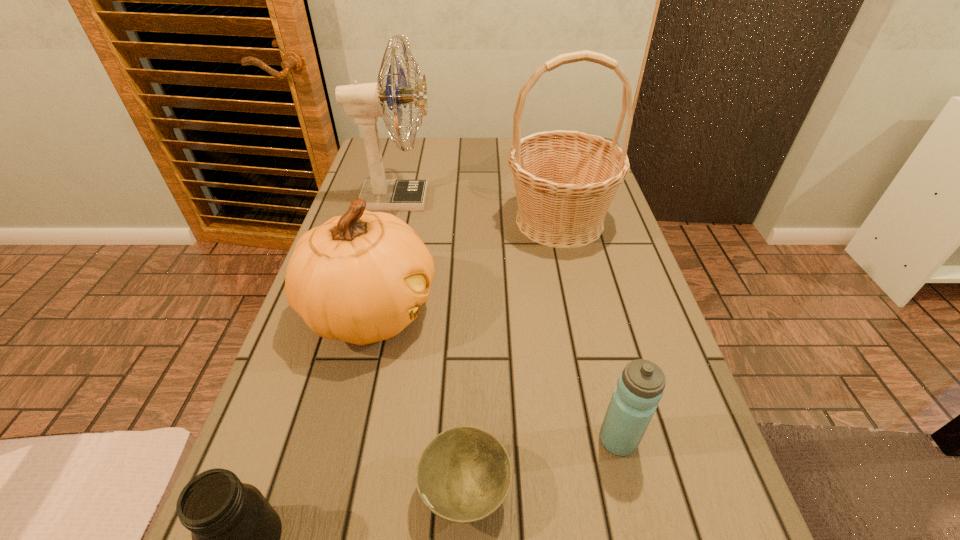
You are a GUI agent. You are given a task and a screenshot of the screen. Output one action in this format:
    pyautogui.click(x=<x>, y=<y>)
    Task: Click on the pumpkin positioned at the left edge
    
    Given the screenshot: What is the action you would take?
    pyautogui.click(x=360, y=278)

At what (x,y) coordinates should I click in order to perform the action: click on basket at the right edge. Please return your answer as a coordinate pair (x, y). Looking at the image, I should click on (565, 181).

Identify the location of water bottle present at the right edge. (640, 387).

Find the location of a particular element. This screenshot has height=540, width=960. free region at the far edge of the desktop is located at coordinates (442, 149).

Locate an element on the screen. free spot at the left edge of the desktop is located at coordinates (265, 485).

Where is `free location at the right edge of the desktop`? free location at the right edge of the desktop is located at coordinates (641, 316).

Identify the location of free space between the fourth tallest object and the basket. The image size is (960, 540). (588, 330).

Find the location of a particular element. The width and height of the screenshot is (960, 540). free space between the fan and the basket is located at coordinates [x=478, y=210].

The width and height of the screenshot is (960, 540). Find the location of `vacant area that lies between the fan and the basket`. vacant area that lies between the fan and the basket is located at coordinates (478, 210).

This screenshot has height=540, width=960. In order to click on vacant area between the fourth tallest object and the fan in this screenshot , I will do `click(507, 320)`.